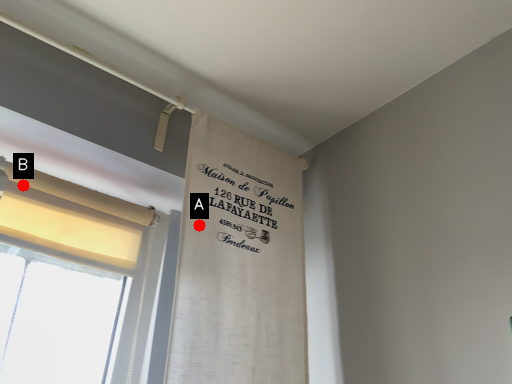
Question: Two points are circled on the image, labeled by A and B beside each circle. Which of the following is the closest to the observer?

Choices:
 (A) A is closer
 (B) B is closer

Answer: (B)